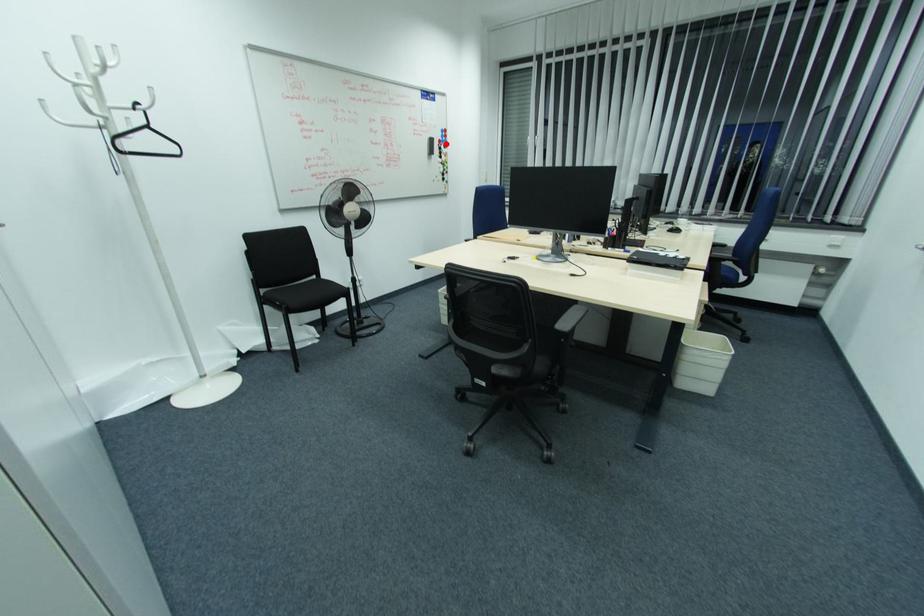
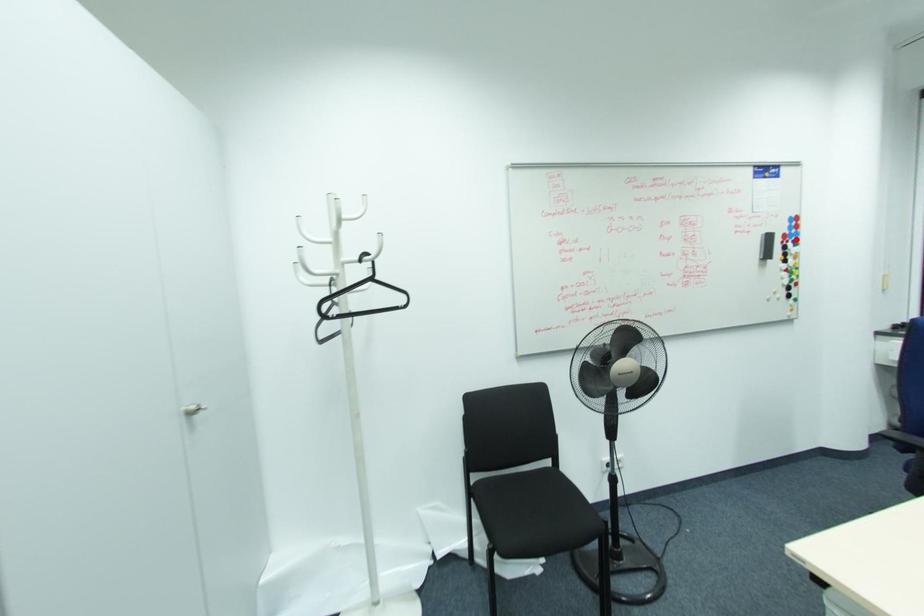
I am providing you with two images of the same scene from different viewpoints. A red point is marked on the first image and another point is marked on the second image. Is the marked point in image1 the same physical position as the marked point in image2?

Yes